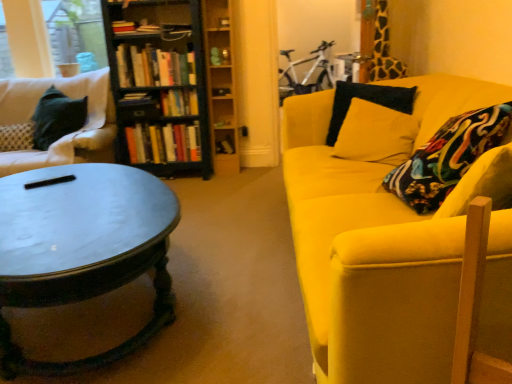
Question: Is hardcover book at center, marked as the 4th book in a top-to-bottom arrangement, spatially inside wooden shelf at center, arranged as the 2th shelf when viewed from the top, or outside of it?

Choices:
 (A) inside
 (B) outside

Answer: (B)

Question: Is point [130, 92] positioned closer to the camera than point [224, 129]?

Choices:
 (A) farther
 (B) closer

Answer: (B)

Question: Which of these objects is positioned closest to the hardcover book at center, which is the first book in bottom-to-top order?

Choices:
 (A) matte black coffee table at left
 (B) hardcover book at center, the 3th book in the top-to-bottom sequence
 (C) black wood bookcase at left
 (D) white metallic bicycle at upper center
 (E) wooden shelf at center, arranged as the first shelf when ordered from the bottom

Answer: (E)

Question: Considering the real-world distances, which object is closest to the white fabric couch at left, acting as the 1th studio couch starting from the left?

Choices:
 (A) hardcover books at center, the fifth book positioned from the bottom
 (B) hardcover books at center, which is the 5th book from top to bottom
 (C) clear glass window screen at upper left
 (D) hardcover book at center, the 6th book when ordered from top to bottom
 (E) hardcover book at center, the 3th book in the top-to-bottom sequence

Answer: (A)